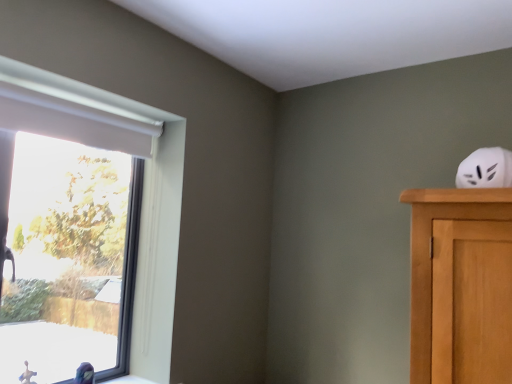
At what (x,y) coordinates should I click in order to perform the action: click on clear glass window at left. Please return your answer as a coordinate pair (x, y). This screenshot has height=384, width=512. Looking at the image, I should click on (144, 187).

What do you see at coordinates (144, 187) in the screenshot? I see `clear glass window at left` at bounding box center [144, 187].

Image resolution: width=512 pixels, height=384 pixels. In order to click on clear glass window at left in this screenshot , I will do `click(144, 187)`.